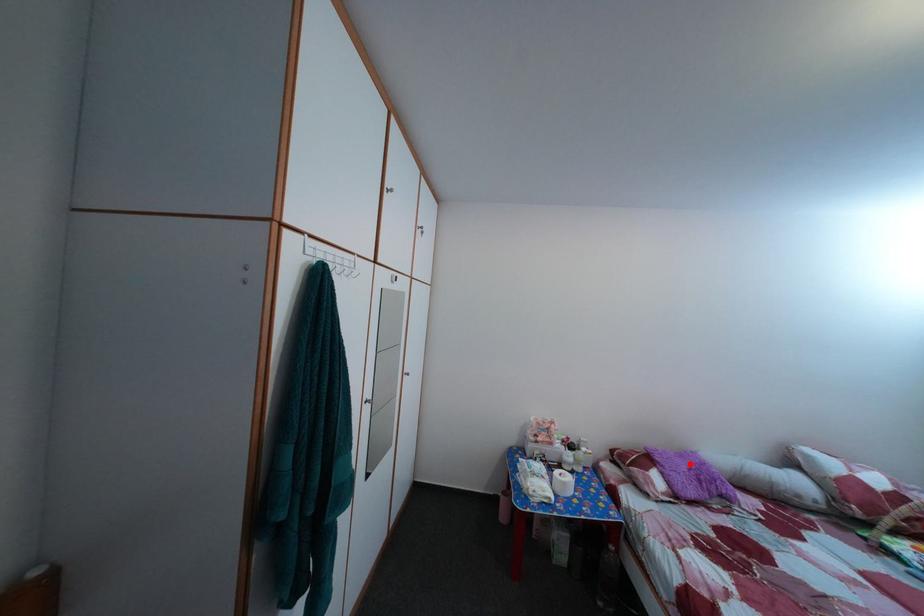
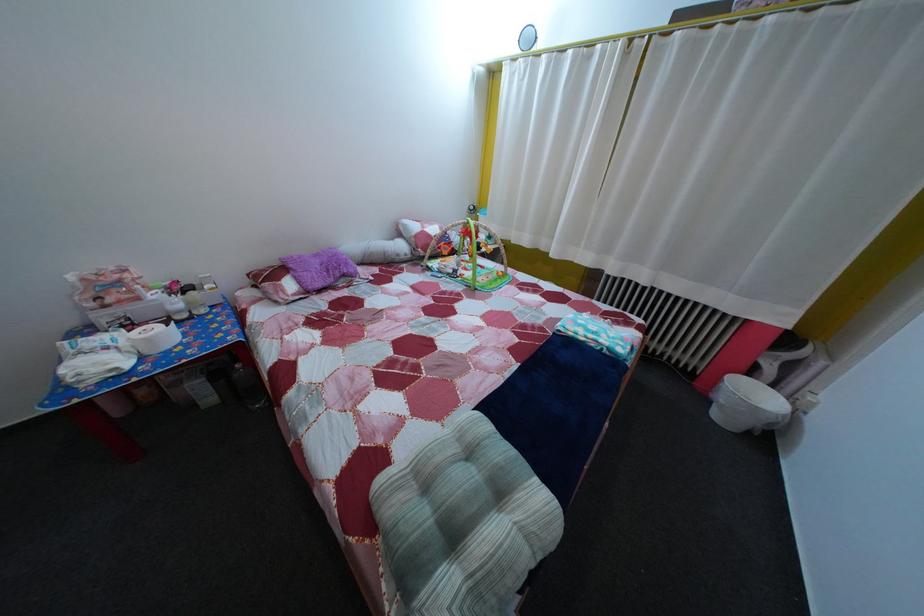
Question: A red point is marked in image1. In image2, is the corresponding 3D point closer to the camera or farther? Reply with the corresponding letter.

Choices:
 (A) The corresponding 3D point is closer.
 (B) The corresponding 3D point is farther.

Answer: (A)